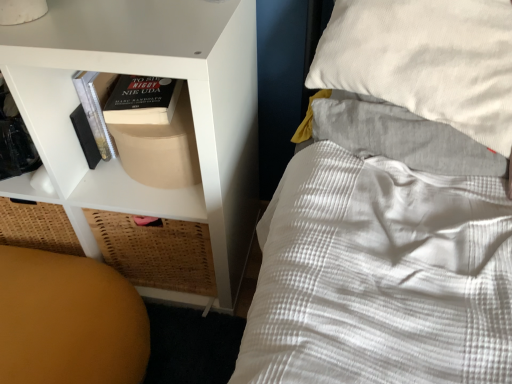
Question: From the image's perspective, relative to orange matte ball at lower left, is white matte shelf at left above or below?

Choices:
 (A) below
 (B) above

Answer: (B)

Question: Would you say white matte shelf at left is to the left or to the right of orange matte ball at lower left in the picture?

Choices:
 (A) left
 (B) right

Answer: (B)

Question: Considering the positions of white matte shelf at left and orange matte ball at lower left in the image, is white matte shelf at left taller or shorter than orange matte ball at lower left?

Choices:
 (A) short
 (B) tall

Answer: (B)

Question: Is orange matte ball at lower left taller or shorter than white matte shelf at left?

Choices:
 (A) short
 (B) tall

Answer: (A)

Question: From the image's perspective, relative to white matte shelf at left, is orange matte ball at lower left above or below?

Choices:
 (A) below
 (B) above

Answer: (A)

Question: From a real-world perspective, is orange matte ball at lower left physically located above or below white matte shelf at left?

Choices:
 (A) below
 (B) above

Answer: (A)

Question: Would you say orange matte ball at lower left is to the left or to the right of white matte shelf at left in the picture?

Choices:
 (A) left
 (B) right

Answer: (A)